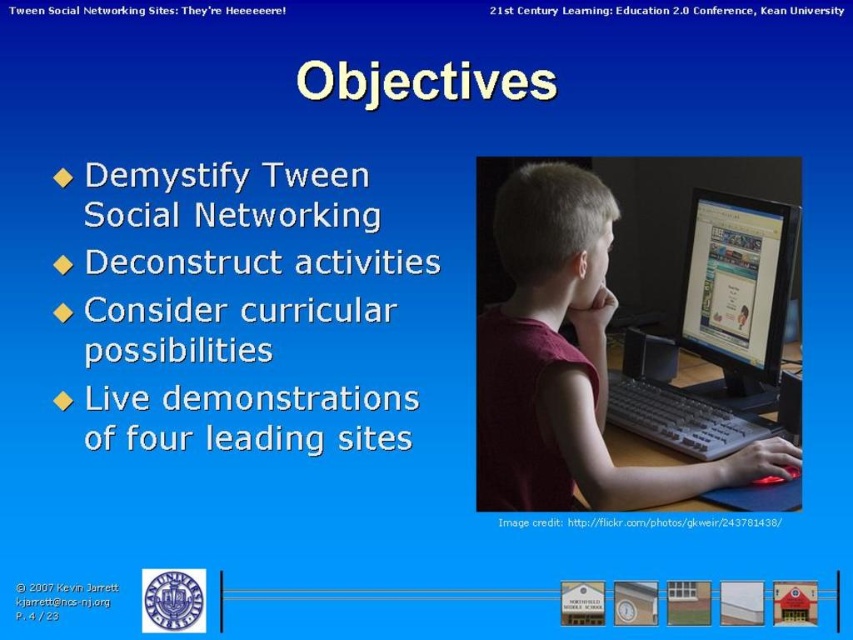
You are a presenter at the conference and want to ensure your audience can see both the matte red shirt at center and the matte black monitor at center clearly. Given that the average human eye can focus on objects within a 12 inch field of view, will both objects remain in the audience members field of view simultaneously?

The matte red shirt at center and the matte black monitor at center are 11.88 inches apart from each other, which is within the 12 inch field of view. Therefore, the audience members can see both objects simultaneously.

You are a conference attendee sitting in the front row of the 21st Century Learning conference. You notice a matte red shirt at center and a matte black monitor at center. Which object is closer to the bottom of the slide?

The matte red shirt at center is below the matte black monitor at center, so it is closer to the bottom of the slide.